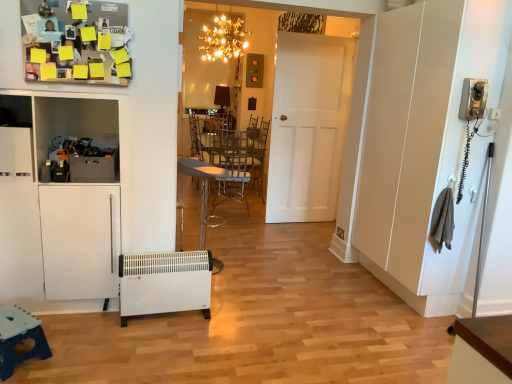
Question: Should I look upward or downward to see metallic silver chair at center?

Choices:
 (A) down
 (B) up

Answer: (A)

Question: Is the depth of white matte door at center greater than that of white plastic heater at lower left?

Choices:
 (A) yes
 (B) no

Answer: (A)

Question: Does white matte door at center have a smaller size compared to white plastic heater at lower left?

Choices:
 (A) yes
 (B) no

Answer: (B)

Question: Is the surface of white matte door at center in direct contact with white plastic heater at lower left?

Choices:
 (A) no
 (B) yes

Answer: (A)

Question: Is white matte door at center shorter than white plastic heater at lower left?

Choices:
 (A) yes
 (B) no

Answer: (B)

Question: Is the depth of white matte door at center less than that of white plastic heater at lower left?

Choices:
 (A) no
 (B) yes

Answer: (A)

Question: Is white matte door at center wider than white plastic heater at lower left?

Choices:
 (A) yes
 (B) no

Answer: (B)

Question: Does blue plastic table at lower left, acting as the 1th table starting from the bottom, turn towards white plastic heater at lower left?

Choices:
 (A) yes
 (B) no

Answer: (B)

Question: Is blue plastic table at lower left, the first table from the front, placed right next to white plastic heater at lower left?

Choices:
 (A) yes
 (B) no

Answer: (B)

Question: From a real-world perspective, does blue plastic table at lower left, which is the 2th table from back to front, sit lower than white plastic heater at lower left?

Choices:
 (A) yes
 (B) no

Answer: (A)

Question: Is white plastic heater at lower left at the back of blue plastic table at lower left, which is the 2th table from back to front?

Choices:
 (A) no
 (B) yes

Answer: (A)

Question: Can you confirm if blue plastic table at lower left, the first table from the front, is shorter than white plastic heater at lower left?

Choices:
 (A) no
 (B) yes

Answer: (B)

Question: Can we say blue plastic table at lower left, which is the 1th table in left-to-right order, lies outside white plastic heater at lower left?

Choices:
 (A) no
 (B) yes

Answer: (B)

Question: Does white plastic heater at lower left have a larger size compared to white matte door at center?

Choices:
 (A) yes
 (B) no

Answer: (B)